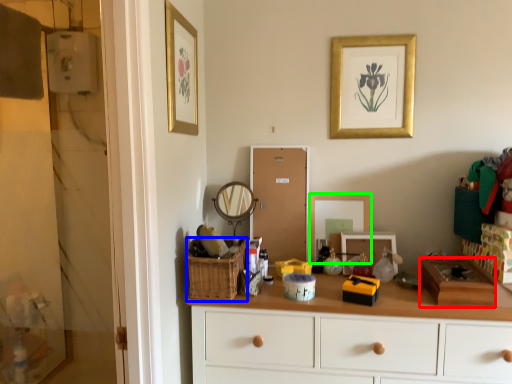
Question: Which object is the farthest from box (highlighted by a red box)? Choose among these: basket (highlighted by a blue box) or mirror (highlighted by a green box).

Choices:
 (A) basket
 (B) mirror

Answer: (A)